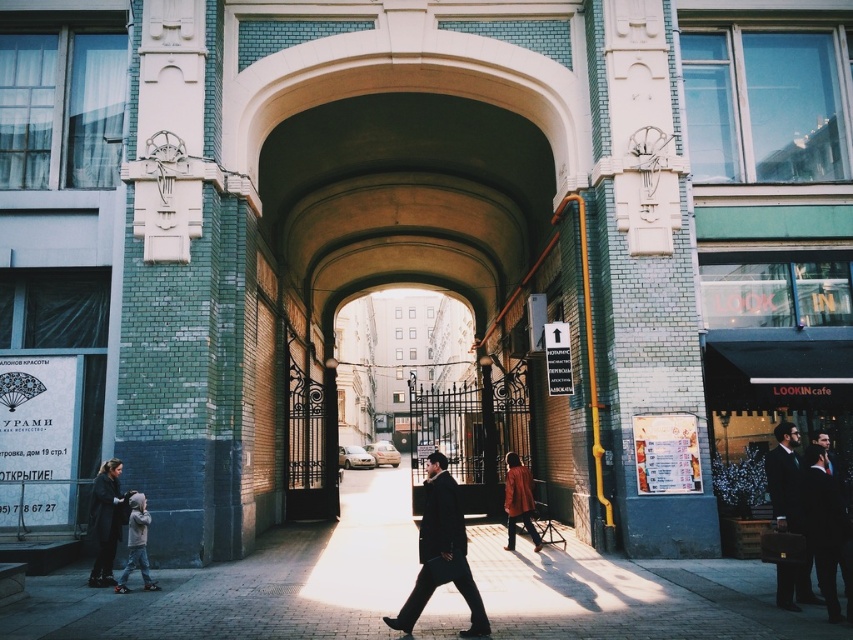
Which is more to the left, dark suit at right or dark gray wool business suit at lower left?

Positioned to the left is dark gray wool business suit at lower left.

Between point (811, 595) and point (112, 486), which one is positioned in front?

Point (811, 595)

Which is behind, point (799, 496) or point (120, 512)?

Positioned behind is point (120, 512).

I want to click on dark suit at right, so click(x=784, y=477).

Which is more to the right, black matte suit at lower right or light gray jacket at lower left?

black matte suit at lower right

Which is more to the left, black matte suit at lower right or light gray jacket at lower left?

Positioned to the left is light gray jacket at lower left.

The width and height of the screenshot is (853, 640). Describe the element at coordinates (825, 531) in the screenshot. I see `black matte suit at lower right` at that location.

Identify the location of black matte suit at lower right. (825, 531).

Image resolution: width=853 pixels, height=640 pixels. I want to click on brick alley at center, so click(x=252, y=582).

Does brick alley at center have a lesser height compared to dark suit at right?

In fact, brick alley at center may be taller than dark suit at right.

Does point (683, 609) come in front of point (772, 484)?

That is True.

Locate an element on the screen. brick alley at center is located at coordinates (252, 582).